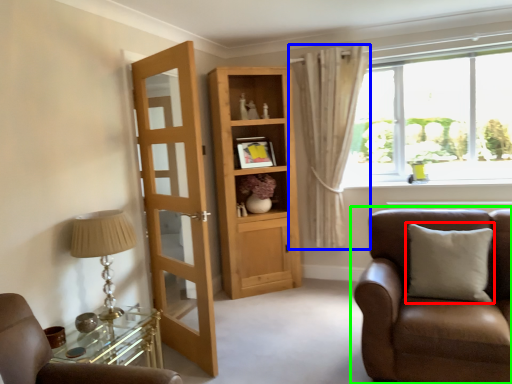
Question: Which is farther away from pillow (highlighted by a red box)? curtain (highlighted by a blue box) or chair (highlighted by a green box)?

Choices:
 (A) curtain
 (B) chair

Answer: (A)